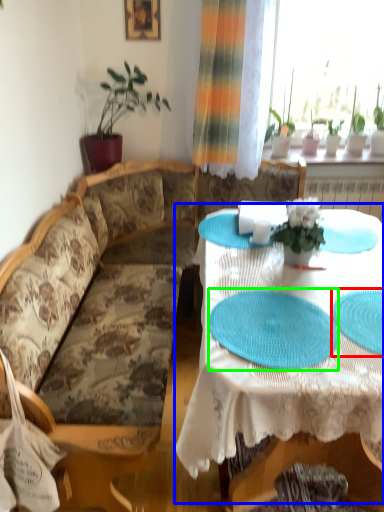
Question: Estimate the real-world distances between objects in this image. Which object is closer to platter (highlighted by a red box), table (highlighted by a blue box) or paper plate (highlighted by a green box)?

Choices:
 (A) table
 (B) paper plate

Answer: (B)